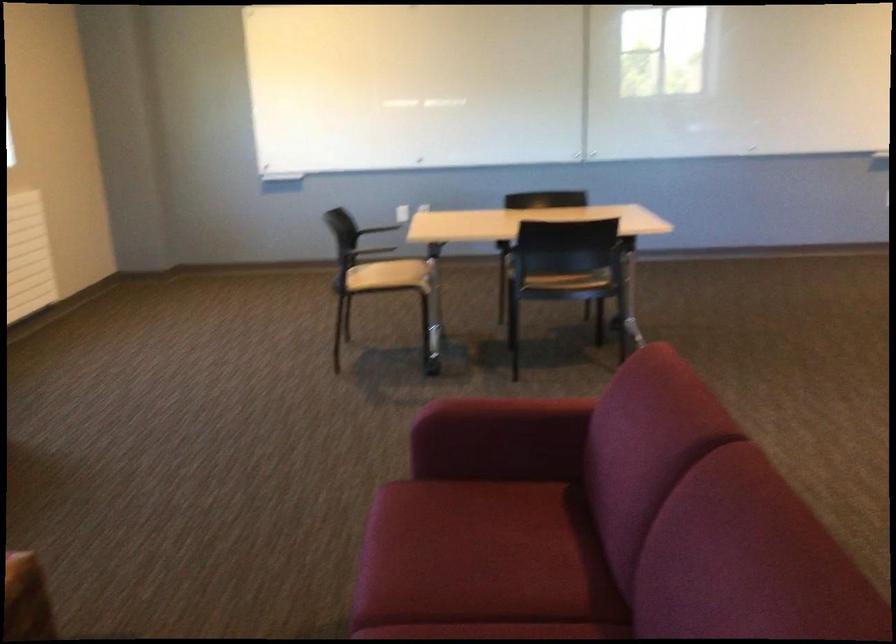
This screenshot has height=644, width=896. What do you see at coordinates (566, 281) in the screenshot?
I see `the black chair sitting surface` at bounding box center [566, 281].